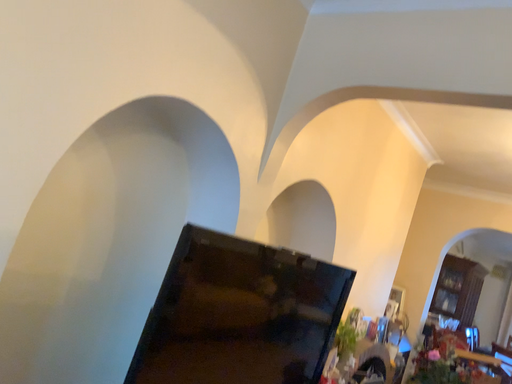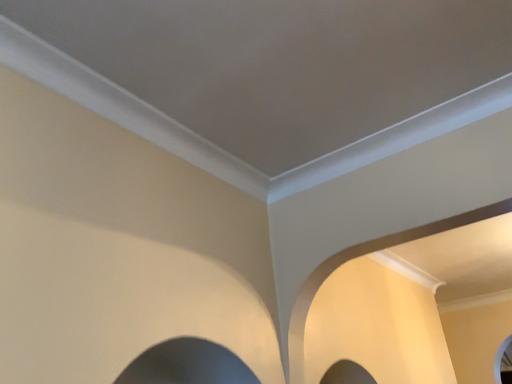
Question: Which way did the camera rotate in the video?

Choices:
 (A) rotated upward
 (B) rotated downward

Answer: (A)